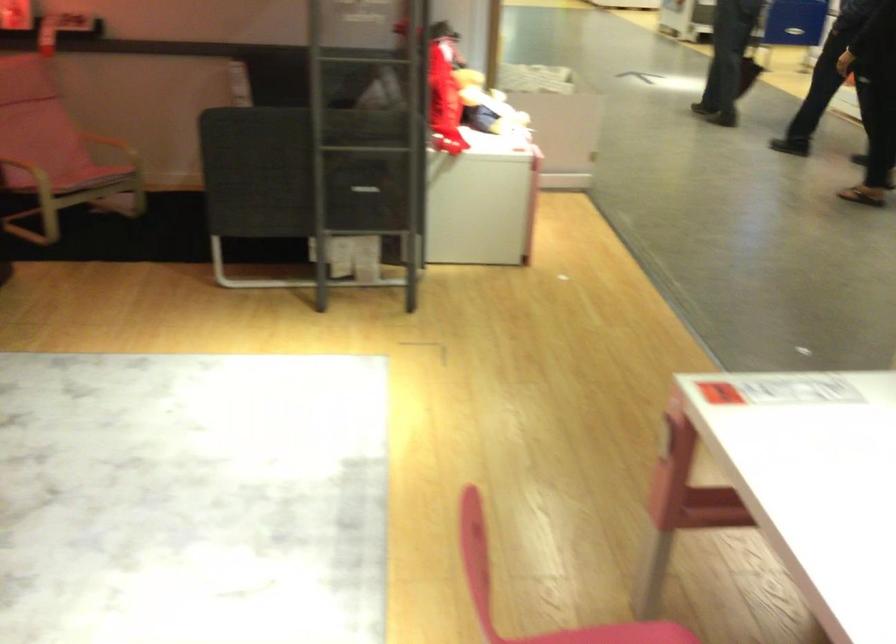
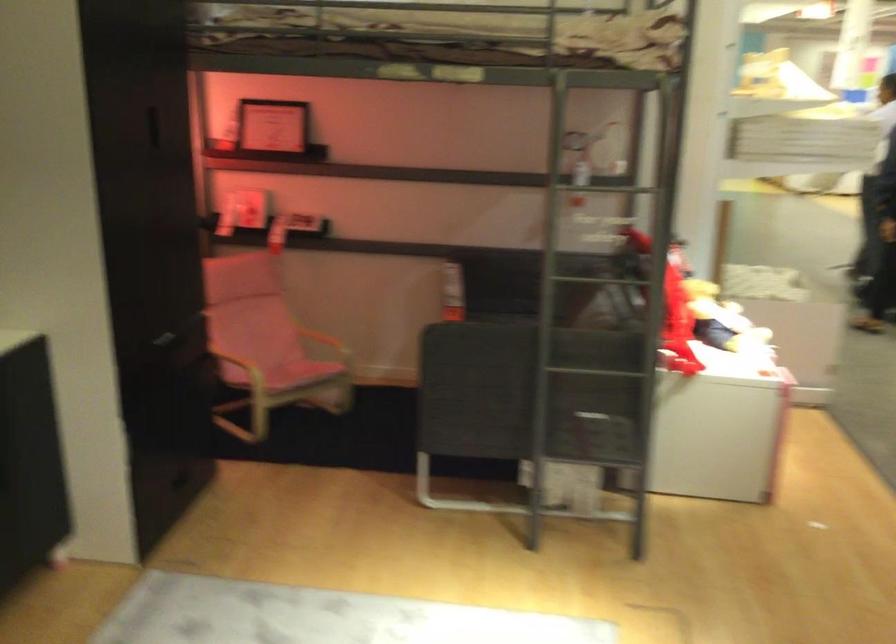
Locate, in the second image, the point that corresponds to (x=386, y=155) in the first image.

(610, 374)